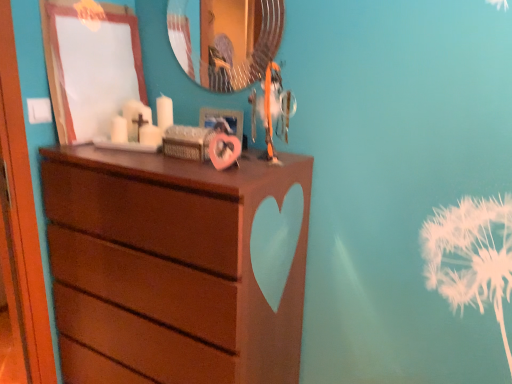
Question: Is the surface of teal glossy mirror at upper center in direct contact with matte white picture frame at upper left, acting as the 2th picture frame starting from the right?

Choices:
 (A) no
 (B) yes

Answer: (A)

Question: Would you say matte white picture frame at upper left, acting as the 2th picture frame starting from the right, is part of teal glossy mirror at upper center's contents?

Choices:
 (A) no
 (B) yes

Answer: (A)

Question: Does teal glossy mirror at upper center have a greater height compared to matte white picture frame at upper left, acting as the 2th picture frame starting from the right?

Choices:
 (A) no
 (B) yes

Answer: (A)

Question: Considering the relative sizes of teal glossy mirror at upper center and matte white picture frame at upper left, positioned as the first picture frame in left-to-right order, in the image provided, is teal glossy mirror at upper center bigger than matte white picture frame at upper left, positioned as the first picture frame in left-to-right order,?

Choices:
 (A) no
 (B) yes

Answer: (A)

Question: From a real-world perspective, is teal glossy mirror at upper center positioned over matte white picture frame at upper left, acting as the 2th picture frame starting from the right, based on gravity?

Choices:
 (A) no
 (B) yes

Answer: (B)

Question: Considering the positions of teal glossy mirror at upper center and matte brown dresser at center in the image, is teal glossy mirror at upper center taller or shorter than matte brown dresser at center?

Choices:
 (A) tall
 (B) short

Answer: (B)

Question: Considering the positions of teal glossy mirror at upper center and matte brown dresser at center in the image, is teal glossy mirror at upper center wider or thinner than matte brown dresser at center?

Choices:
 (A) wide
 (B) thin

Answer: (B)

Question: Is point (247, 6) closer or farther from the camera than point (140, 331)?

Choices:
 (A) closer
 (B) farther

Answer: (B)

Question: From a real-world perspective, is teal glossy mirror at upper center positioned above or below matte brown dresser at center?

Choices:
 (A) above
 (B) below

Answer: (A)

Question: From the image's perspective, is teal glossy mirror at upper center above or below metallic silver picture frame at upper center, the 2th picture frame in the left-to-right sequence?

Choices:
 (A) below
 (B) above

Answer: (B)

Question: Considering the positions of teal glossy mirror at upper center and metallic silver picture frame at upper center, the 2th picture frame in the left-to-right sequence, in the image, is teal glossy mirror at upper center taller or shorter than metallic silver picture frame at upper center, the 2th picture frame in the left-to-right sequence,?

Choices:
 (A) short
 (B) tall

Answer: (B)

Question: Which is correct: teal glossy mirror at upper center is inside metallic silver picture frame at upper center, the 2th picture frame in the left-to-right sequence, or outside of it?

Choices:
 (A) outside
 (B) inside

Answer: (A)

Question: Is point click(203, 57) closer or farther from the camera than point click(210, 122)?

Choices:
 (A) closer
 (B) farther

Answer: (B)

Question: Considering their positions, is matte white picture frame at upper left, acting as the 2th picture frame starting from the right, located in front of or behind teal glossy mirror at upper center?

Choices:
 (A) front
 (B) behind

Answer: (A)

Question: Considering the positions of point (78, 21) and point (187, 24), is point (78, 21) closer or farther from the camera than point (187, 24)?

Choices:
 (A) closer
 (B) farther

Answer: (A)